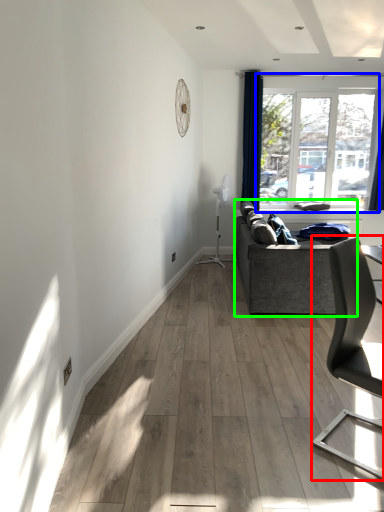
Question: Which object is positioned farthest from chair (highlighted by a red box)? Select from window (highlighted by a blue box) and studio couch (highlighted by a green box).

Choices:
 (A) window
 (B) studio couch

Answer: (A)